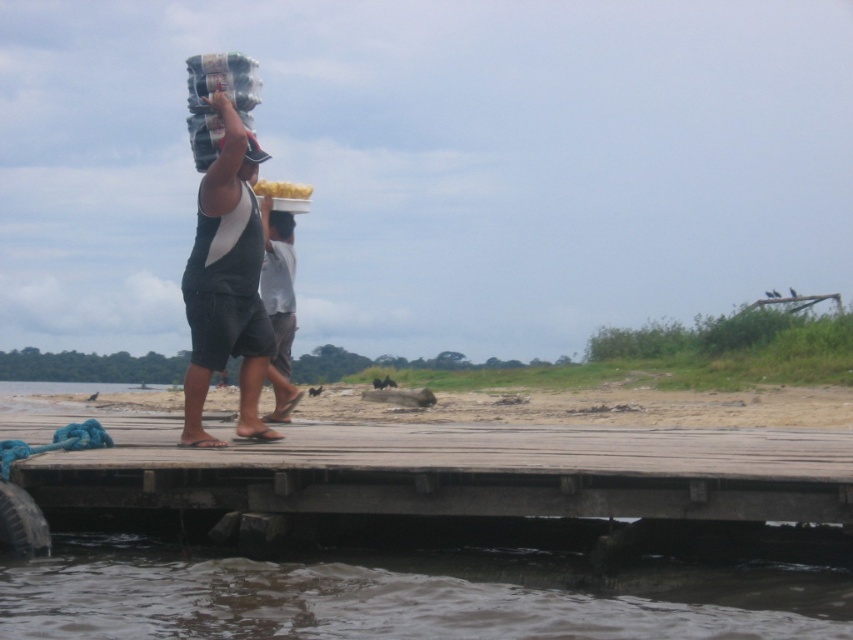
Question: Is the position of brown murky water at lower left more distant than that of dark gray fabric shirt at center?

Choices:
 (A) no
 (B) yes

Answer: (A)

Question: Which point is closer to the camera taking this photo?

Choices:
 (A) (628, 516)
 (B) (267, 278)
 (C) (564, 621)

Answer: (C)

Question: In this image, where is wooden dock at center located relative to dark gray shorts at center?

Choices:
 (A) below
 (B) above

Answer: (A)

Question: Does wooden dock at center appear on the left side of brown murky water at lower left?

Choices:
 (A) no
 (B) yes

Answer: (A)

Question: Which point appears closest to the camera in this image?

Choices:
 (A) (543, 465)
 (B) (202, 316)
 (C) (28, 625)
 (D) (286, 349)

Answer: (C)

Question: Which is farther from the dark gray fabric shirt at center?

Choices:
 (A) wooden dock at center
 (B) dark gray shorts at center

Answer: (A)